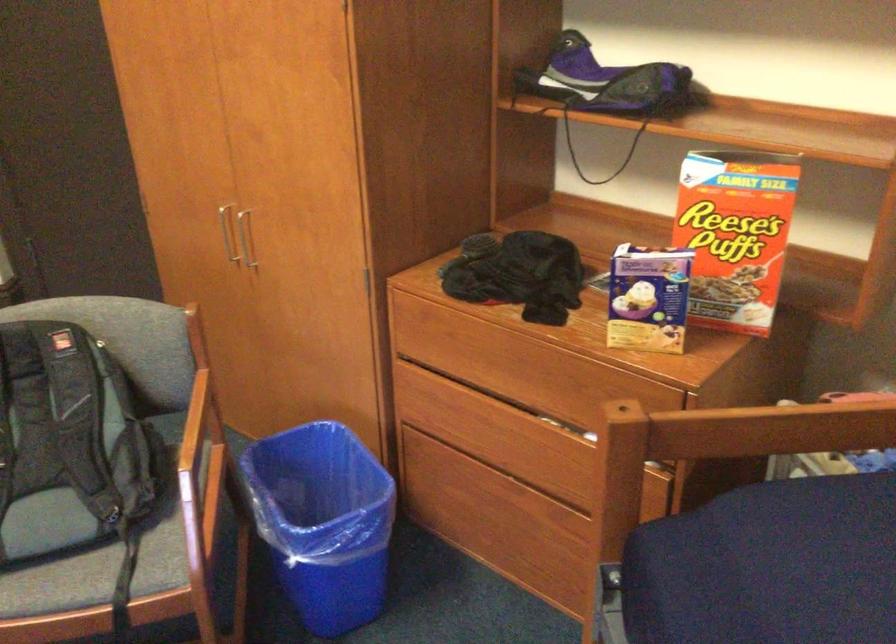
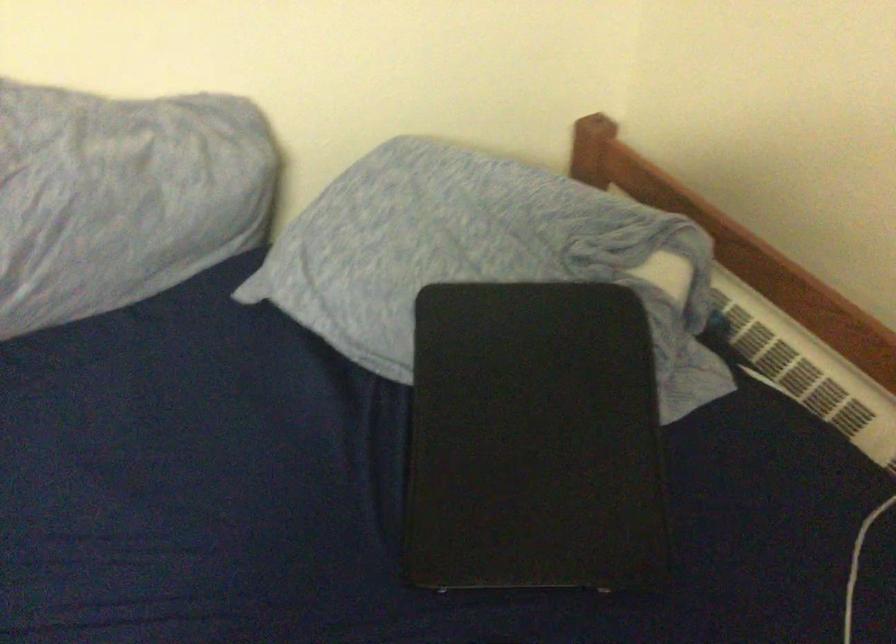
How did the camera likely rotate?

The camera rotated toward right-down.